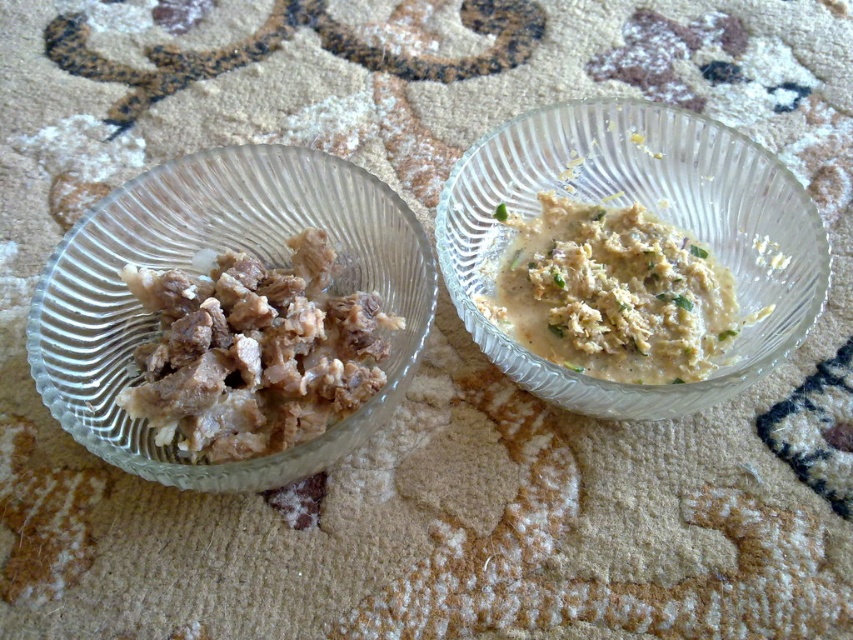
Question: Is brown meat at left wider than white creamy paste at center?

Choices:
 (A) no
 (B) yes

Answer: (A)

Question: Which object is positioned farthest from the clear glass bowl at left?

Choices:
 (A) brown meat at left
 (B) clear glass bowl at upper right
 (C) white creamy paste at center

Answer: (C)

Question: Based on their relative distances, which object is nearer to the white creamy paste at center?

Choices:
 (A) clear glass bowl at upper right
 (B) brown meat at left
 (C) clear glass bowl at left

Answer: (A)

Question: Can you confirm if clear glass bowl at left is positioned above white creamy paste at center?

Choices:
 (A) no
 (B) yes

Answer: (A)

Question: Where is clear glass bowl at upper right located in relation to brown meat at left in the image?

Choices:
 (A) left
 (B) right

Answer: (B)

Question: Which point is farther to the camera?

Choices:
 (A) (718, 353)
 (B) (415, 333)
 (C) (807, 269)
 (D) (316, 307)

Answer: (A)